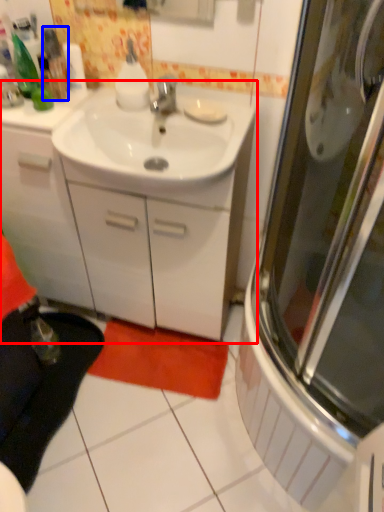
Question: Which object is further to the camera taking this photo, bathroom cabinet (highlighted by a red box) or bottle (highlighted by a blue box)?

Choices:
 (A) bathroom cabinet
 (B) bottle

Answer: (B)